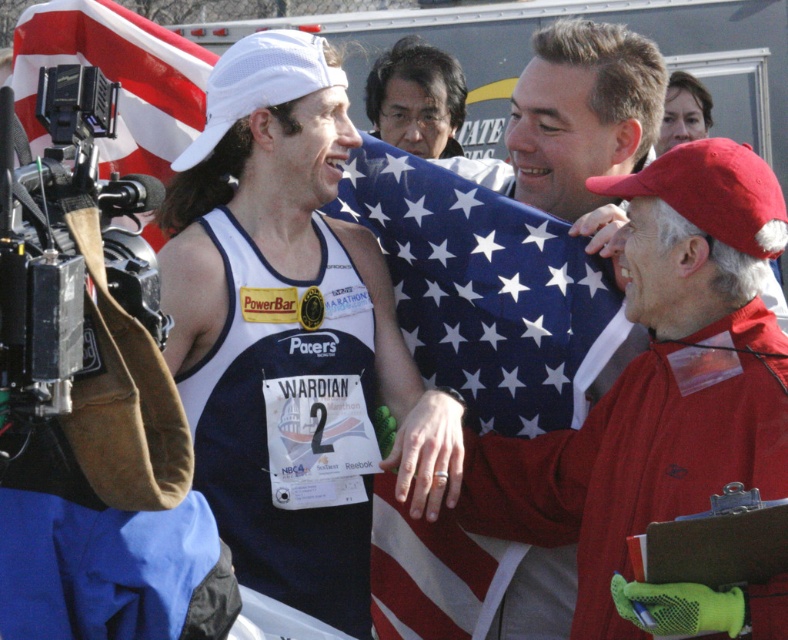
Is blue fabric flag at center above red-white striped flag at left?

Incorrect, blue fabric flag at center is not positioned above red-white striped flag at left.

Does blue fabric flag at center have a greater width compared to red-white striped flag at left?

Yes, blue fabric flag at center is wider than red-white striped flag at left.

Which is in front, point (422, 595) or point (180, 45)?

Point (422, 595)

Locate an element on the screen. The width and height of the screenshot is (788, 640). blue fabric flag at center is located at coordinates (489, 292).